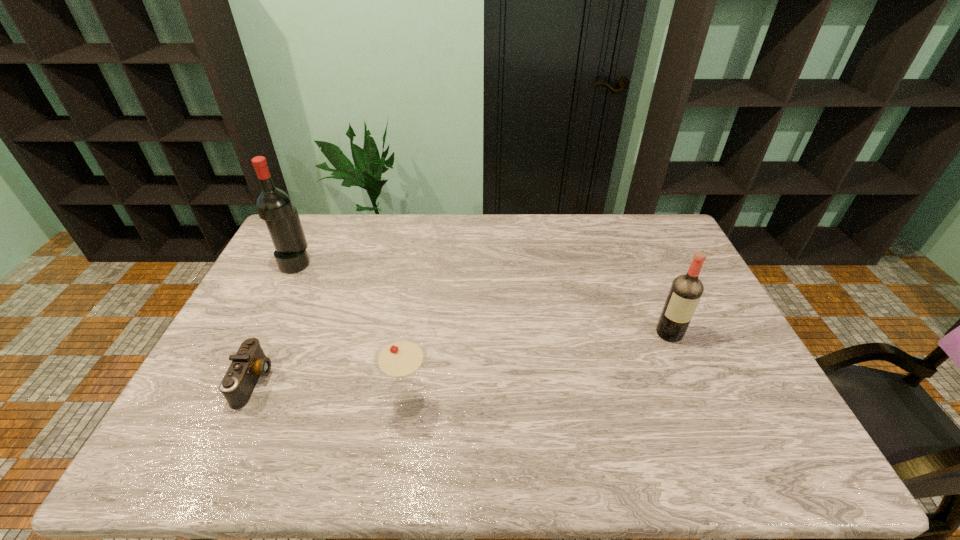
Locate an element on the screen. vacant area that lies between the camera and the wine bottle is located at coordinates (275, 322).

Select which object appears as the closest to the farthest object. Please provide its 2D coordinates. Your answer should be formatted as a tuple, i.e. [(x, y)], where the tuple contains the x and y coordinates of a point satisfying the conditions above.

[(250, 362)]

Locate an element on the screen. the closest object relative to the tallest object is located at coordinates (250, 362).

You are a GUI agent. You are given a task and a screenshot of the screen. Output one action in this format:
    pyautogui.click(x=<x>, y=<y>)
    Task: Click on the vacant space that satisfies the following two spatial constraints: 1. on the front-facing side of the second tallest object; 2. on the lens of the shortest object
    This screenshot has height=540, width=960.
    Given the screenshot: What is the action you would take?
    pyautogui.click(x=690, y=381)

Identify the location of vacant region that satisfies the following two spatial constraints: 1. on the lens of the camera; 2. on the left side of the martini. This screenshot has width=960, height=540. (244, 403).

The height and width of the screenshot is (540, 960). Identify the location of free spot that satisfies the following two spatial constraints: 1. on the front-facing side of the second farthest object; 2. on the lens of the camera. [690, 381].